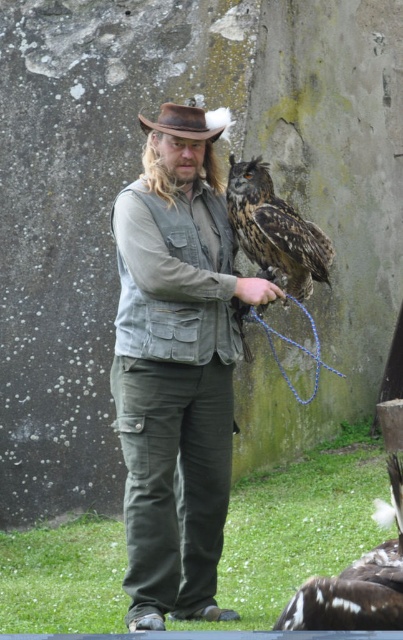
Question: Is leather vest at center smaller than brown speckled feathers at center?

Choices:
 (A) no
 (B) yes

Answer: (A)

Question: Is dark brown feathers at lower right closer to the viewer compared to matte brown glove at center?

Choices:
 (A) yes
 (B) no

Answer: (A)

Question: Which object appears closest to the camera in this image?

Choices:
 (A) brown speckled feathers at center
 (B) denim vest at center
 (C) leather vest at center
 (D) matte brown glove at center

Answer: (C)

Question: Is denim vest at center to the right of matte brown glove at center from the viewer's perspective?

Choices:
 (A) yes
 (B) no

Answer: (B)

Question: Which object is positioned farthest from the matte brown glove at center?

Choices:
 (A) dark brown feathers at lower right
 (B) brown speckled feathers at center
 (C) denim vest at center

Answer: (A)

Question: Which object is the closest to the brown leather cowboy hat at center?

Choices:
 (A) brown speckled feathers at center
 (B) matte brown glove at center
 (C) leather vest at center
 (D) denim vest at center

Answer: (A)